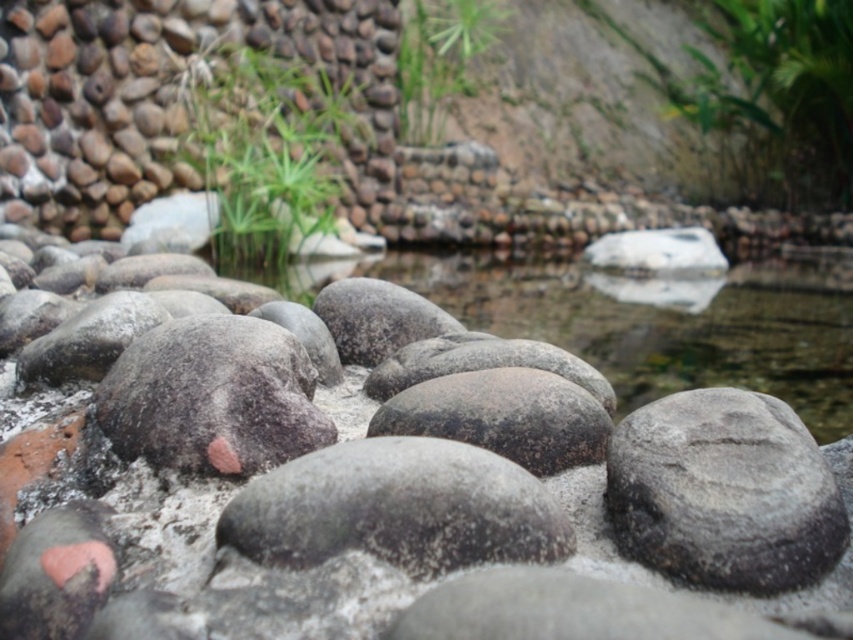
Question: Can you confirm if gray matte rock at center is positioned to the right of green leafy plant at center?

Choices:
 (A) yes
 (B) no

Answer: (A)

Question: Is green leafy plant at upper right below green grass at upper center?

Choices:
 (A) yes
 (B) no

Answer: (B)

Question: Which of the following is the farthest from the observer?

Choices:
 (A) (227, 252)
 (B) (752, 29)
 (C) (466, 0)

Answer: (B)

Question: Among these points, which one is farthest from the camera?

Choices:
 (A) (177, 513)
 (B) (190, 102)
 (C) (444, 109)
 (D) (782, 19)

Answer: (D)

Question: Which of these objects is positioned farthest from the gray matte rock at center?

Choices:
 (A) green leafy plant at upper right
 (B) green leafy plant at center

Answer: (A)

Question: Is green leafy plant at center smaller than green grass at upper center?

Choices:
 (A) yes
 (B) no

Answer: (B)